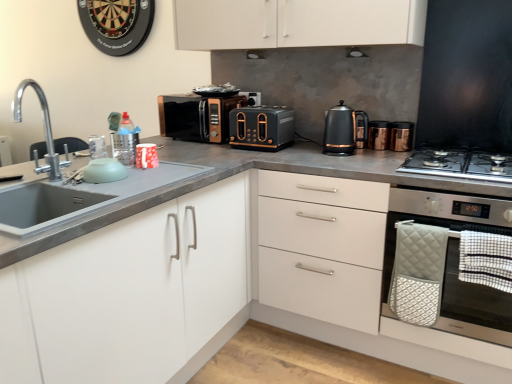
Where is `free location in front of matte green bowl at left, which ranks as the first appliance in front-to-back order`? Image resolution: width=512 pixels, height=384 pixels. free location in front of matte green bowl at left, which ranks as the first appliance in front-to-back order is located at coordinates (101, 181).